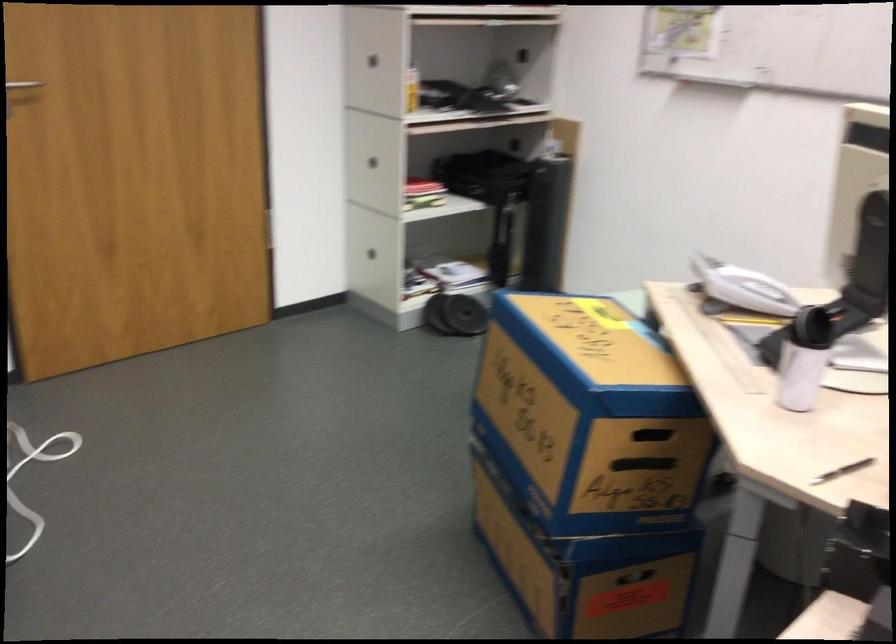
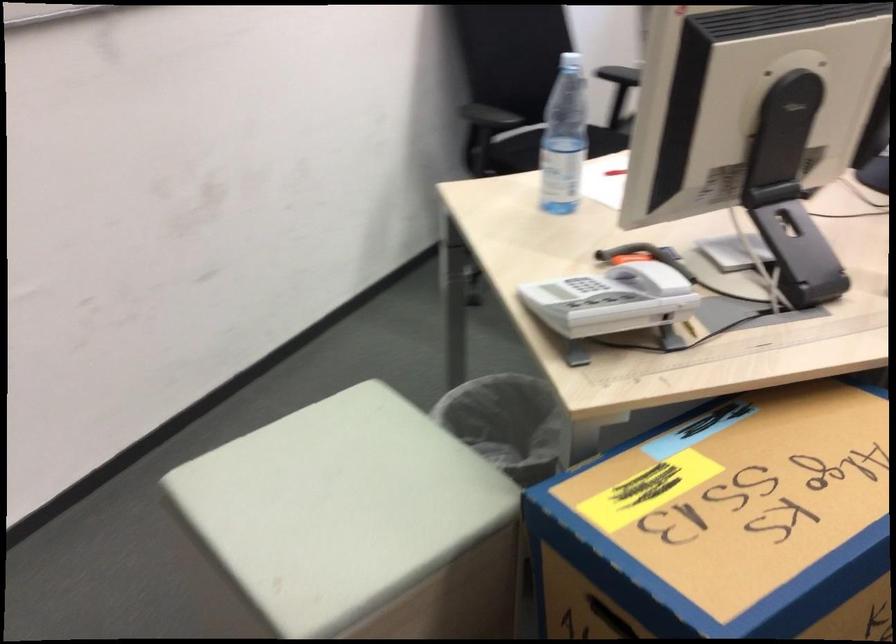
Where in the second image is the point corresponding to [729,339] from the first image?

(746, 334)